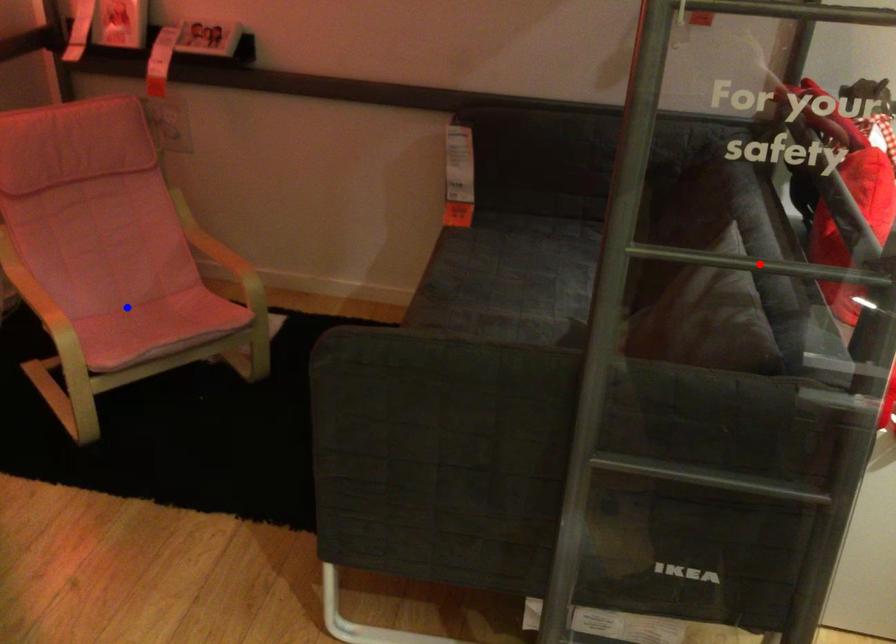
Question: Two points are marked on the image. Which point is closer to the camera?

Choices:
 (A) Blue point is closer.
 (B) Red point is closer.

Answer: (B)